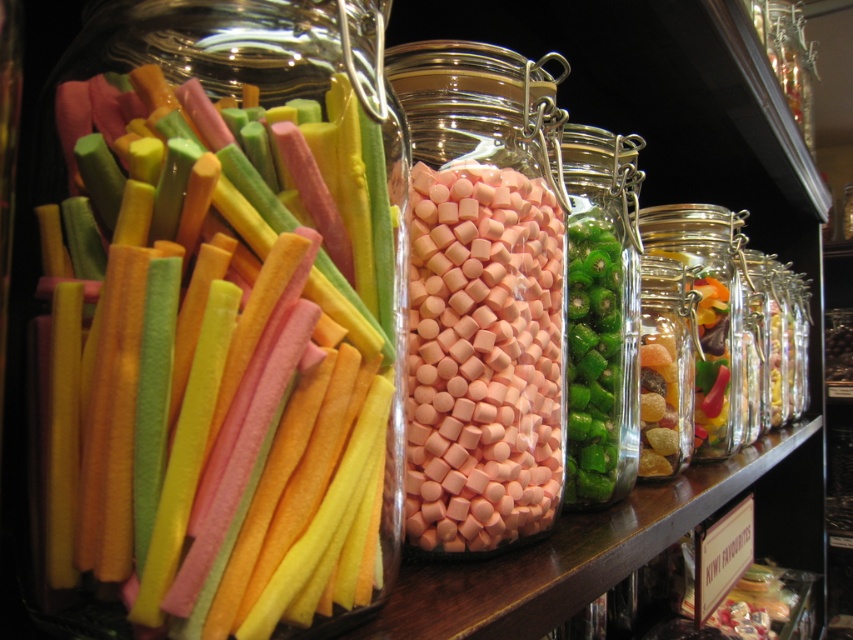
Question: Is green glossy kiwi at center bigger than translucent glass candy at right?

Choices:
 (A) yes
 (B) no

Answer: (A)

Question: Which object is positioned farthest from the pink matte marshmallows at center?

Choices:
 (A) green glossy kiwi at center
 (B) translucent glass candy at right

Answer: (B)

Question: Does pink matte marshmallows at center appear over green glossy kiwi at center?

Choices:
 (A) no
 (B) yes

Answer: (A)

Question: Estimate the real-world distances between objects in this image. Which object is farther from the soft candy sticks at left?

Choices:
 (A) pink matte marshmallows at center
 (B) green glossy kiwi at center
 (C) translucent glass candy at right

Answer: (C)

Question: Which object is closer to the camera taking this photo?

Choices:
 (A) soft candy sticks at left
 (B) translucent glass candy at right

Answer: (A)

Question: Is soft candy sticks at left positioned in front of pink matte marshmallows at center?

Choices:
 (A) yes
 (B) no

Answer: (A)